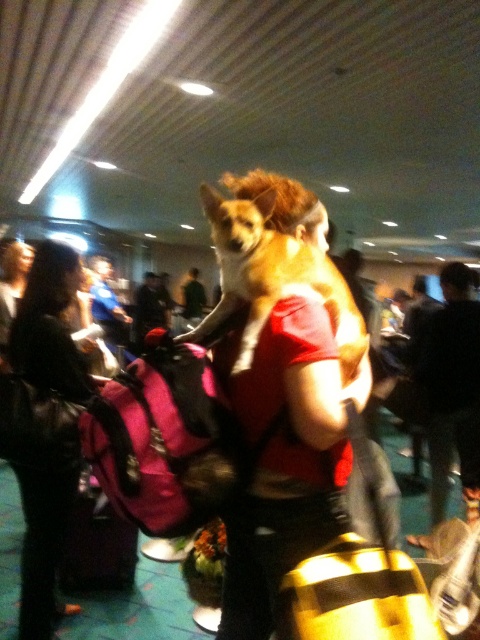
Question: Is black leather jacket at left bigger than brown furry dog at center?

Choices:
 (A) no
 (B) yes

Answer: (B)

Question: Which point is closer to the camera taking this photo?

Choices:
 (A) click(x=346, y=324)
 (B) click(x=41, y=596)

Answer: (A)

Question: Which point is closer to the camera?

Choices:
 (A) (232, 284)
 (B) (44, 253)

Answer: (A)

Question: Which object appears farthest from the camera in this image?

Choices:
 (A) black leather jacket at left
 (B) brown furry dog at center

Answer: (A)

Question: Is black leather jacket at left positioned in front of brown furry dog at center?

Choices:
 (A) yes
 (B) no

Answer: (B)

Question: Does black leather jacket at left have a larger size compared to brown furry dog at center?

Choices:
 (A) no
 (B) yes

Answer: (B)